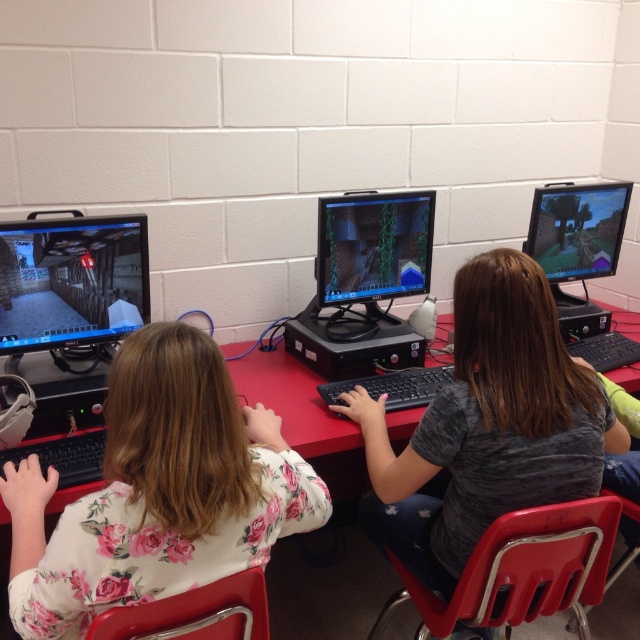
Question: Which object is the farthest from the matte black monitor at left?

Choices:
 (A) red plastic table at center
 (B) matte black monitor at center
 (C) floral shirt at center
 (D) matte black monitor at right

Answer: (D)

Question: Considering the real-world distances, which object is farthest from the matte black monitor at right?

Choices:
 (A) floral shirt at center
 (B) matte black monitor at center
 (C) red plastic table at center

Answer: (A)

Question: Observing the image, what is the correct spatial positioning of floral shirt at center in reference to matte black monitor at center?

Choices:
 (A) above
 (B) below

Answer: (B)

Question: Can you confirm if matte black monitor at center is thinner than matte black monitor at right?

Choices:
 (A) yes
 (B) no

Answer: (A)

Question: Does floral shirt at center appear on the left side of matte black monitor at center?

Choices:
 (A) yes
 (B) no

Answer: (A)

Question: Which of the following is the closest to the observer?

Choices:
 (A) matte black monitor at left
 (B) red plastic table at center
 (C) matte black monitor at center

Answer: (A)